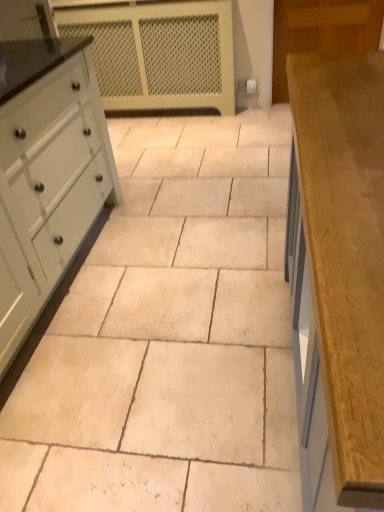
Question: Considering the relative sizes of white painted wood chest of drawers at left and beige stone tile at center in the image provided, is white painted wood chest of drawers at left thinner than beige stone tile at center?

Choices:
 (A) yes
 (B) no

Answer: (A)

Question: From the image's perspective, is white painted wood chest of drawers at left below beige stone tile at center?

Choices:
 (A) no
 (B) yes

Answer: (A)

Question: Is beige stone tile at center a part of white painted wood chest of drawers at left?

Choices:
 (A) yes
 (B) no

Answer: (B)

Question: Is white painted wood chest of drawers at left oriented away from beige stone tile at center?

Choices:
 (A) no
 (B) yes

Answer: (A)

Question: Does white painted wood chest of drawers at left turn towards beige stone tile at center?

Choices:
 (A) yes
 (B) no

Answer: (A)

Question: Is white painted wood chest of drawers at left at the left side of beige stone tile at center?

Choices:
 (A) yes
 (B) no

Answer: (A)

Question: Considering the relative sizes of wooden countertop at right and beige stone tile at center in the image provided, is wooden countertop at right bigger than beige stone tile at center?

Choices:
 (A) yes
 (B) no

Answer: (A)

Question: Is wooden countertop at right smaller than beige stone tile at center?

Choices:
 (A) no
 (B) yes

Answer: (A)

Question: From the image's perspective, does wooden countertop at right appear lower than beige stone tile at center?

Choices:
 (A) no
 (B) yes

Answer: (B)

Question: Is wooden countertop at right positioned far away from beige stone tile at center?

Choices:
 (A) no
 (B) yes

Answer: (A)

Question: Is wooden countertop at right facing away from beige stone tile at center?

Choices:
 (A) no
 (B) yes

Answer: (A)

Question: Is wooden countertop at right further to camera compared to beige stone tile at center?

Choices:
 (A) no
 (B) yes

Answer: (A)

Question: Is beige stone tile at center closer to the viewer compared to white painted wood chest of drawers at left?

Choices:
 (A) no
 (B) yes

Answer: (B)